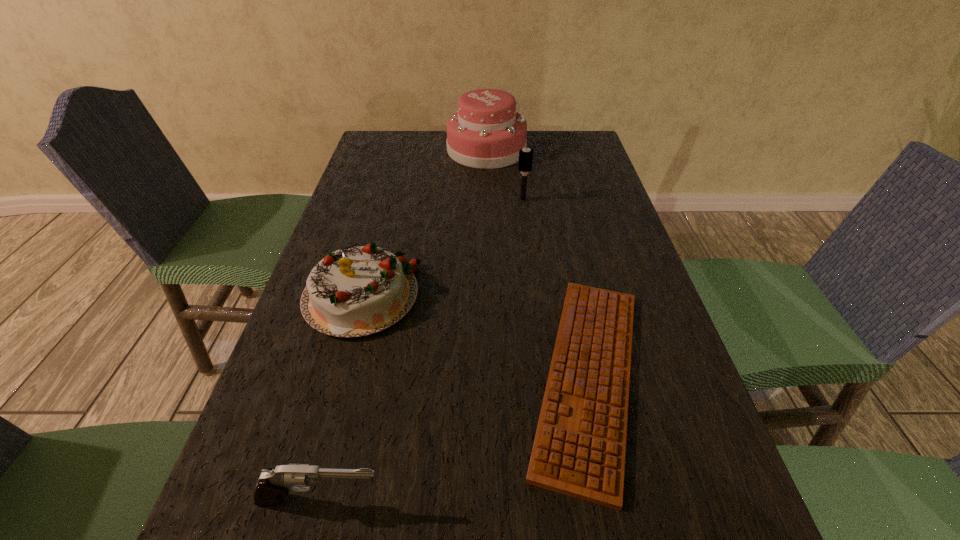
The image size is (960, 540). I want to click on free space located at the muzzle of the second shortest object, so click(x=597, y=501).

What are the coordinates of `free space located 0.400m on the left of the computer keyboard` in the screenshot? It's located at (304, 375).

At what (x,y) coordinates should I click in order to perform the action: click on object located in the far edge section of the desktop. Please return your answer as a coordinate pair (x, y). Looking at the image, I should click on [x=486, y=132].

Where is `cake that is at the left edge`? Image resolution: width=960 pixels, height=540 pixels. cake that is at the left edge is located at coordinates (356, 291).

Locate an element on the screen. This screenshot has height=540, width=960. gun that is at the left edge is located at coordinates click(272, 484).

This screenshot has height=540, width=960. I want to click on object that is at the right edge, so click(579, 449).

In the image, there is a desktop. Where is `vacant space at the far edge`? The height and width of the screenshot is (540, 960). vacant space at the far edge is located at coordinates (451, 161).

Identify the location of free space at the left edge of the desktop. (243, 483).

You are a GUI agent. You are given a task and a screenshot of the screen. Output one action in this format:
    pyautogui.click(x=<x>, y=<y>)
    Task: Click on the vacant space at the right edge of the desktop
    The image size is (960, 540).
    Given the screenshot: What is the action you would take?
    pyautogui.click(x=578, y=178)

Locate an element on the screen. The image size is (960, 540). vacant space at the far left corner is located at coordinates (379, 141).